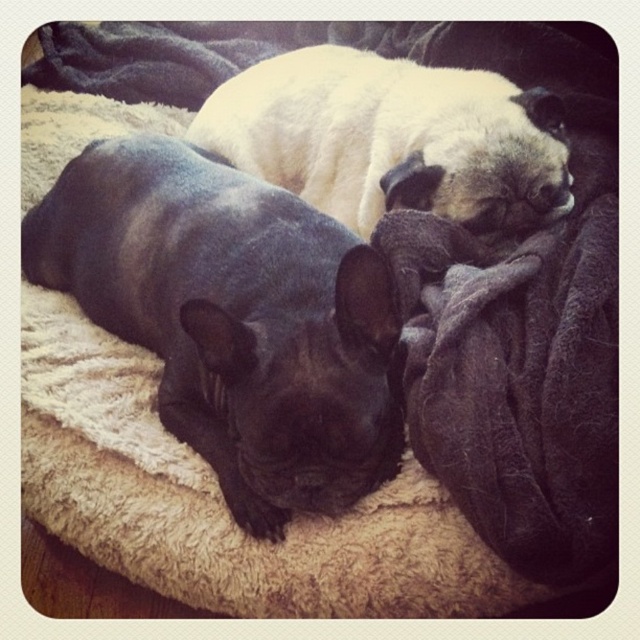
What do you see at coordinates (232, 317) in the screenshot? I see `black smooth french bulldog at left` at bounding box center [232, 317].

Does point (253, 189) come behind point (346, 148)?

No, it is in front of (346, 148).

What are the coordinates of `black smooth french bulldog at left` in the screenshot? It's located at (232, 317).

Does dark gray plush blanket at center-right have a larger size compared to white fur dog at upper center?

No.

Can you confirm if dark gray plush blanket at center-right is positioned to the left of white fur dog at upper center?

No, dark gray plush blanket at center-right is not to the left of white fur dog at upper center.

Who is more forward, (518, 524) or (452, 172)?

Point (518, 524) is more forward.

At what (x,y) coordinates should I click in order to perform the action: click on dark gray plush blanket at center-right. Please return your answer as a coordinate pair (x, y). Looking at the image, I should click on (516, 381).

Image resolution: width=640 pixels, height=640 pixels. What do you see at coordinates (232, 317) in the screenshot?
I see `black smooth french bulldog at left` at bounding box center [232, 317].

Does point (36, 275) lie behind point (588, 248)?

Yes, point (36, 275) is behind point (588, 248).

You are a GUI agent. You are given a task and a screenshot of the screen. Output one action in this format:
    pyautogui.click(x=<x>, y=<y>)
    Task: Click on the black smooth french bulldog at left
    The width and height of the screenshot is (640, 640).
    Given the screenshot: What is the action you would take?
    pyautogui.click(x=232, y=317)